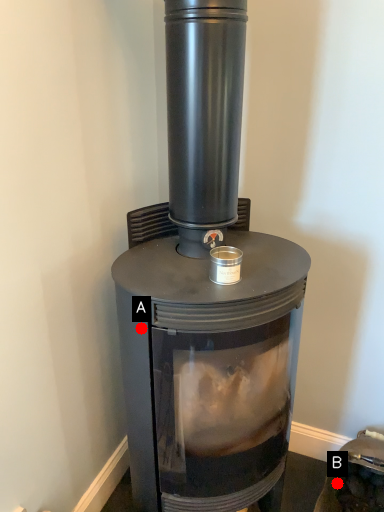
Question: Two points are circled on the image, labeled by A and B beside each circle. Which of the following is the closest to the observer?

Choices:
 (A) A is closer
 (B) B is closer

Answer: (A)